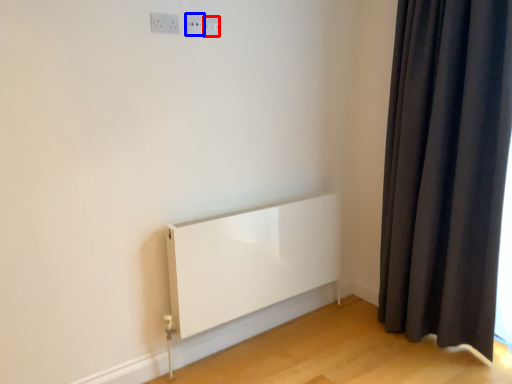
Question: Which object appears closest to the camera in this image, electric outlet (highlighted by a red box) or electric outlet (highlighted by a blue box)?

Choices:
 (A) electric outlet
 (B) electric outlet

Answer: (B)